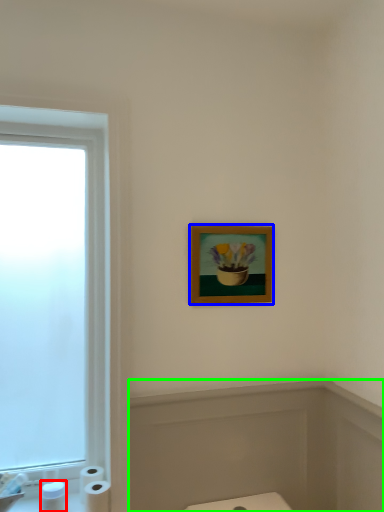
Question: Estimate the real-world distances between objects in this image. Which object is farther from toiletry (highlighted by a red box), picture frame (highlighted by a blue box) or bath (highlighted by a green box)?

Choices:
 (A) picture frame
 (B) bath

Answer: (A)